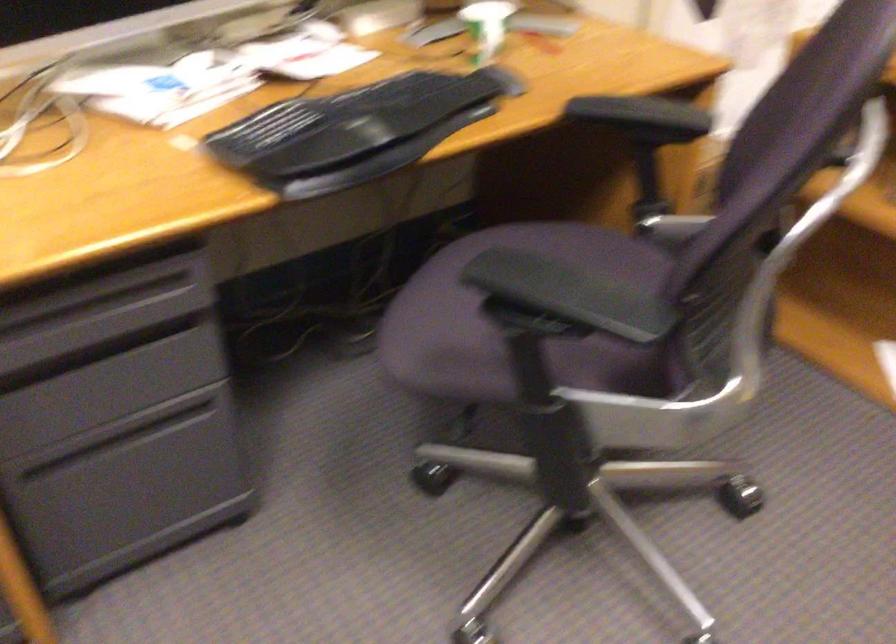
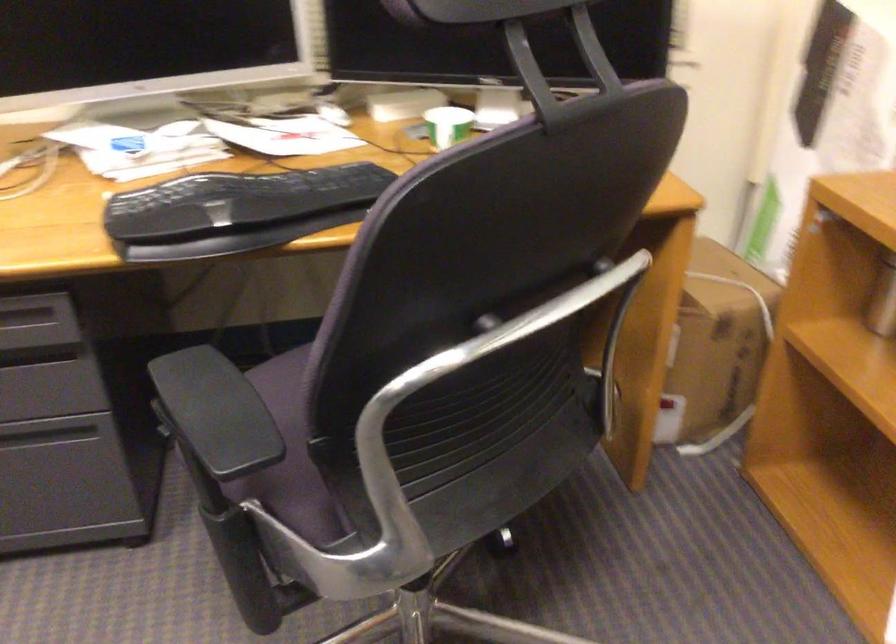
Question: In a continuous first-person perspective shot, in which direction is the camera moving?

Choices:
 (A) Left
 (B) Right
 (C) Forward
 (D) Backward

Answer: (B)